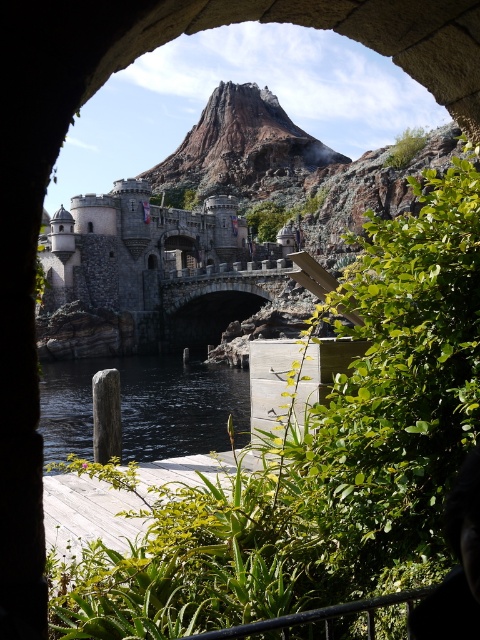
You are an architect examining this historical site. You notice the stone bridge at center and the black smooth water at lower center. Which object is closer to your viewpoint?

The stone bridge at center is closer to the viewer than the black smooth water at lower center.

You are standing inside the stone archway and want to see the castle in the background. Is the green leafy plant at center blocking your view of the castle?

The green leafy plant at center is located at point (319,456), which might be partially obscuring the view of the castle, so it could be blocking your view depending on the exact position.